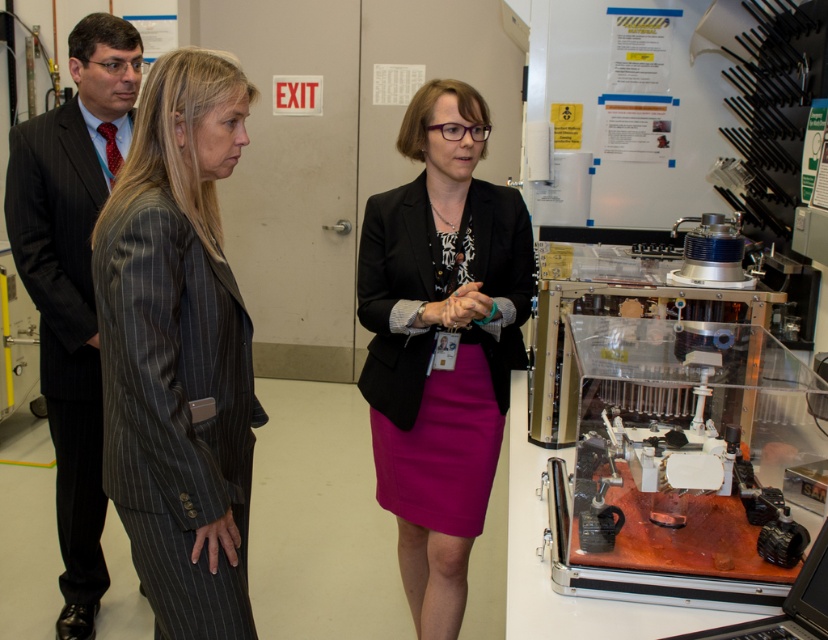
Based on the photo, can you confirm if gray pinstripe suit at left is taller than black plastic laptop at lower right?

Yes, gray pinstripe suit at left is taller than black plastic laptop at lower right.

Is gray pinstripe suit at left smaller than black plastic laptop at lower right?

No.

Where is `gray pinstripe suit at left`? gray pinstripe suit at left is located at coordinates (179, 352).

Is matte black blazer at center taller than black plastic laptop at lower right?

Correct, matte black blazer at center is much taller as black plastic laptop at lower right.

Between matte black blazer at center and black plastic laptop at lower right, which one has more height?

With more height is matte black blazer at center.

This screenshot has width=828, height=640. Find the location of `matte black blazer at center`. matte black blazer at center is located at coordinates (440, 346).

Does gray pinstripe suit at left appear over matte black blazer at center?

Correct, gray pinstripe suit at left is located above matte black blazer at center.

At what (x,y) coordinates should I click in order to perform the action: click on gray pinstripe suit at left. Please return your answer as a coordinate pair (x, y). The height and width of the screenshot is (640, 828). Looking at the image, I should click on (179, 352).